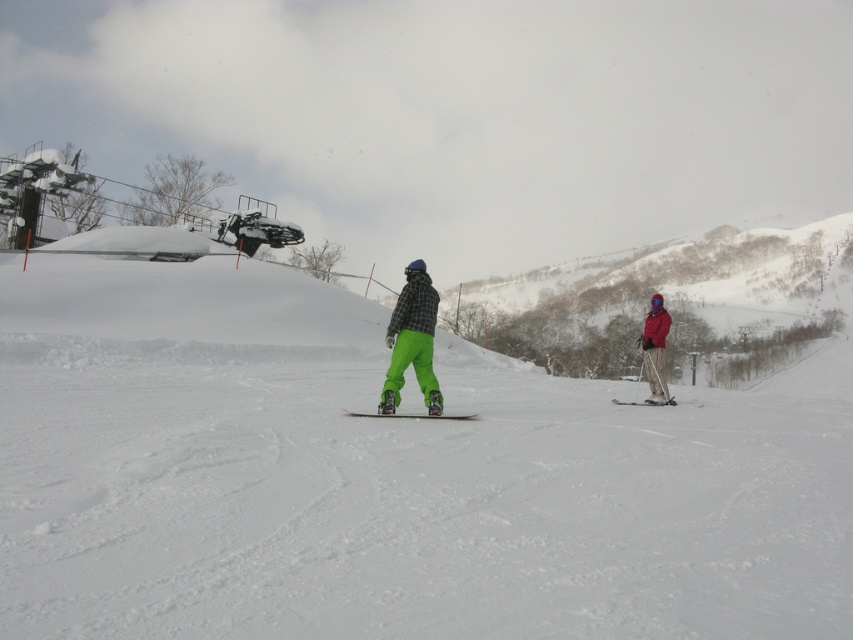
Question: Based on their relative distances, which object is farther from the green matte snowboard at center?

Choices:
 (A) matte black snowboard at center
 (B) matte red ski jacket at right
 (C) white fluffy snow at center
 (D) green matte snowboarder at center

Answer: (C)

Question: In this image, where is white fluffy snow at center located relative to matte black snowboard at center?

Choices:
 (A) left
 (B) right

Answer: (B)

Question: Which of the following is the closest to the observer?

Choices:
 (A) white fluffy snow at center
 (B) neon green snowboard at center
 (C) matte black snowboard at center
 (D) matte red ski jacket at right

Answer: (A)

Question: Which point is closer to the camera taking this photo?

Choices:
 (A) (813, 374)
 (B) (404, 273)

Answer: (B)

Question: Is matte red ski jacket at right further to the viewer compared to green matte snowboard at center?

Choices:
 (A) no
 (B) yes

Answer: (B)

Question: Is white fluffy snow at center bigger than green matte snowboarder at center?

Choices:
 (A) no
 (B) yes

Answer: (B)